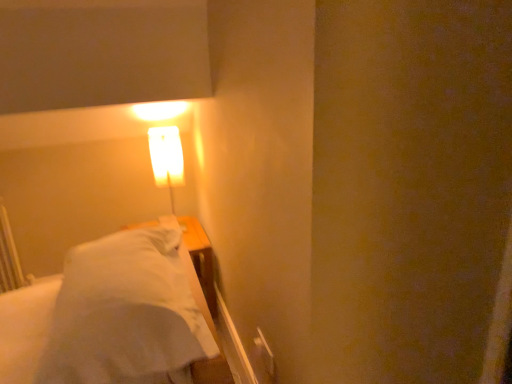
Question: From the image's perspective, is white soft bed at left positioned above or below matte white lamp at upper left?

Choices:
 (A) above
 (B) below

Answer: (B)

Question: Does point tap(6, 369) appear closer or farther from the camera than point tap(166, 158)?

Choices:
 (A) farther
 (B) closer

Answer: (B)

Question: From a real-world perspective, relative to matte white lamp at upper left, is white soft bed at left vertically above or below?

Choices:
 (A) below
 (B) above

Answer: (A)

Question: Based on their sizes in the image, would you say matte white lamp at upper left is bigger or smaller than white soft bed at left?

Choices:
 (A) big
 (B) small

Answer: (B)

Question: Would you say matte white lamp at upper left is to the left or to the right of white soft bed at left in the picture?

Choices:
 (A) right
 (B) left

Answer: (B)

Question: Is matte white lamp at upper left in front of or behind white soft bed at left in the image?

Choices:
 (A) behind
 (B) front

Answer: (A)

Question: Looking at their shapes, would you say matte white lamp at upper left is wider or thinner than white soft bed at left?

Choices:
 (A) thin
 (B) wide

Answer: (A)